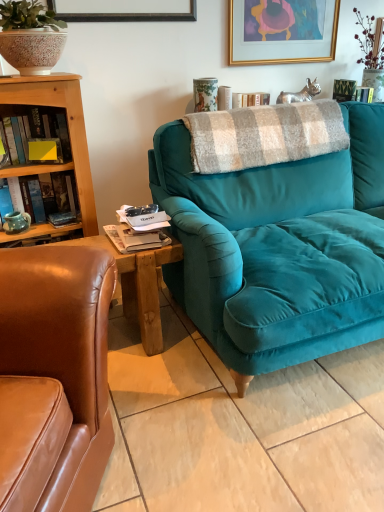
Question: In terms of width, does gold-framed artwork at upper center look wider or thinner when compared to yellow matte sticky note at left, the first book in the top-to-bottom sequence?

Choices:
 (A) thin
 (B) wide

Answer: (A)

Question: Is gold-framed artwork at upper center to the left or to the right of yellow matte sticky note at left, the second book in the bottom-to-top sequence, in the image?

Choices:
 (A) left
 (B) right

Answer: (B)

Question: Which object is the closest to the gold-framed artwork at upper center?

Choices:
 (A) matte ceramic mug at left
 (B) yellow matte sticky note at left, the second book in the bottom-to-top sequence
 (C) teal matte mug at left, acting as the first book starting from the bottom
 (D) teal velvet couch at center
 (E) plaid woolen blanket at center

Answer: (E)

Question: Based on their relative distances, which object is nearer to the gold-framed artwork at upper center?

Choices:
 (A) matte ceramic mug at left
 (B) yellow matte sticky note at left, the second book in the bottom-to-top sequence
 (C) teal velvet couch at center
 (D) teal matte mug at left, acting as the first book starting from the bottom
 (E) plaid woolen blanket at center

Answer: (E)